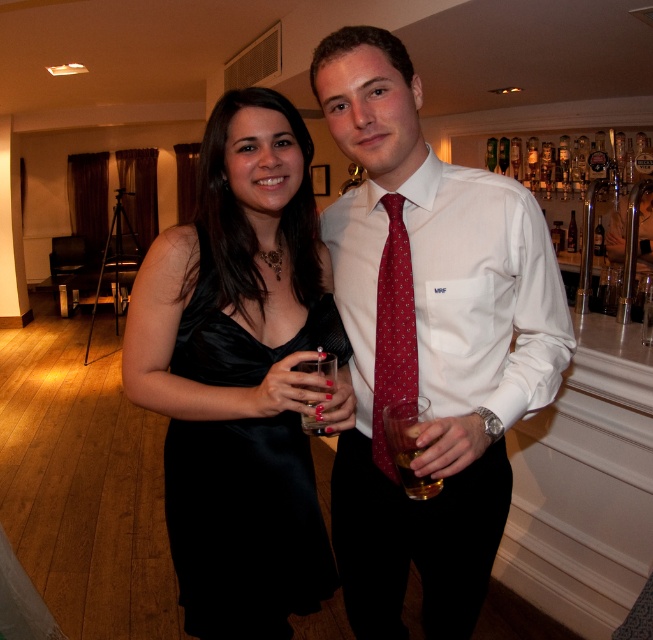
Who is shorter, clear plastic cup at center or translucent glass at lower center?

translucent glass at lower center is shorter.

Does clear plastic cup at center have a lesser height compared to translucent glass at lower center?

In fact, clear plastic cup at center may be taller than translucent glass at lower center.

Where is `clear plastic cup at center`? clear plastic cup at center is located at coordinates (321, 369).

Locate an element on the screen. The height and width of the screenshot is (640, 653). clear plastic cup at center is located at coordinates (321, 369).

Who is more forward, (x=217, y=608) or (x=394, y=412)?

Positioned in front is point (x=394, y=412).

From the picture: How distant is satin black dress at center from translucent amber liquid at center?

satin black dress at center and translucent amber liquid at center are 34.82 centimeters apart.

Which is behind, point (276, 600) or point (413, 444)?

The point (276, 600) is behind.

What are the coordinates of `satin black dress at center` in the screenshot? It's located at (244, 525).

Is translucent amber liquid at center shorter than translucent glass at lower center?

No.

Looking at this image, is translucent amber liquid at center to the left of translucent glass at lower center from the viewer's perspective?

Yes, translucent amber liquid at center is to the left of translucent glass at lower center.

Image resolution: width=653 pixels, height=640 pixels. What are the coordinates of `translucent amber liquid at center` in the screenshot? It's located at (407, 444).